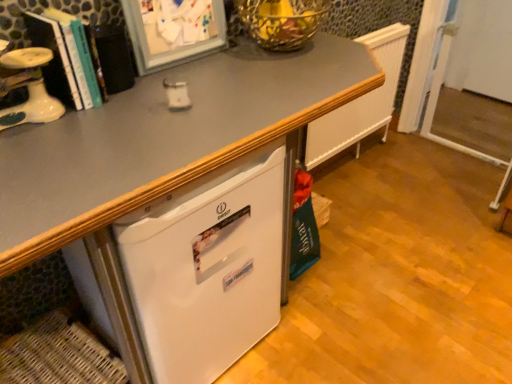
You are a GUI agent. You are given a task and a screenshot of the screen. Output one action in this format:
    pyautogui.click(x=<x>, y=<y>)
    Task: Click on the vacant space that is in between white glossy desk at center and white textured radiator at upper right
    The image size is (512, 384).
    Given the screenshot: What is the action you would take?
    pyautogui.click(x=354, y=193)